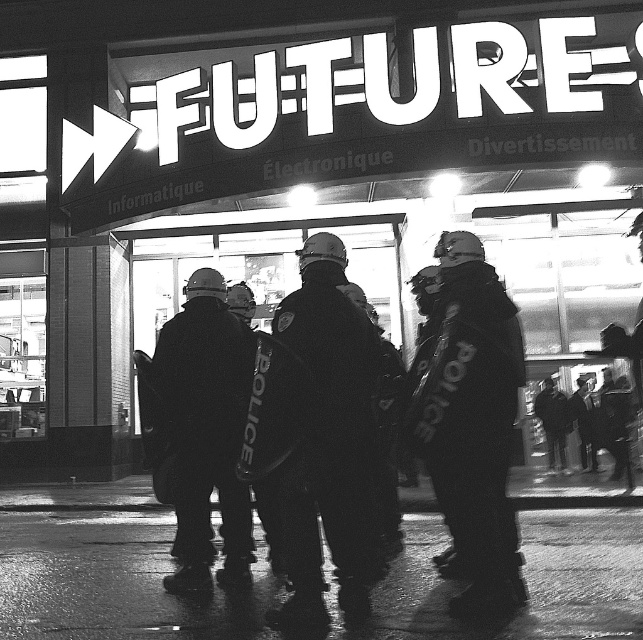
Question: Can you confirm if reflective black police uniform at center is positioned to the right of hard hat helmet at center?

Choices:
 (A) no
 (B) yes

Answer: (B)

Question: Among these points, which one is farthest from the camera?

Choices:
 (A) (298, 252)
 (B) (509, 394)

Answer: (A)

Question: Which point appears closest to the camera in this image?

Choices:
 (A) (249, 577)
 (B) (462, 474)

Answer: (B)

Question: Which of the following is the closest to the observer?

Choices:
 (A) reflective black police uniform at center
 (B) hard hat helmet at center
 (C) dark matte police uniform at center

Answer: (A)

Question: Can you confirm if reflective black police uniform at center is smaller than hard hat helmet at center?

Choices:
 (A) no
 (B) yes

Answer: (B)

Question: Is reflective black police uniform at center to the right of hard hat helmet at center from the viewer's perspective?

Choices:
 (A) no
 (B) yes

Answer: (B)